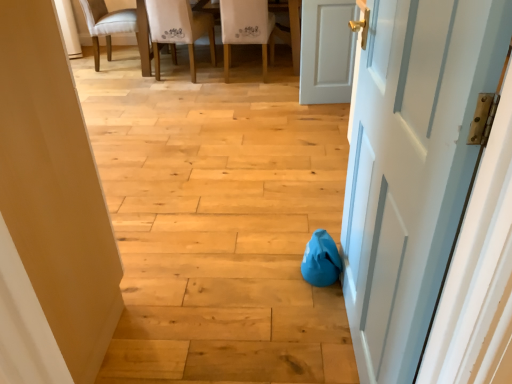
Identify the location of free area in between light beige fabric chair at upper left, which is the first chair in left-to-right order, and white painted wood door at right, arranged as the third door when viewed from the back. (195, 161).